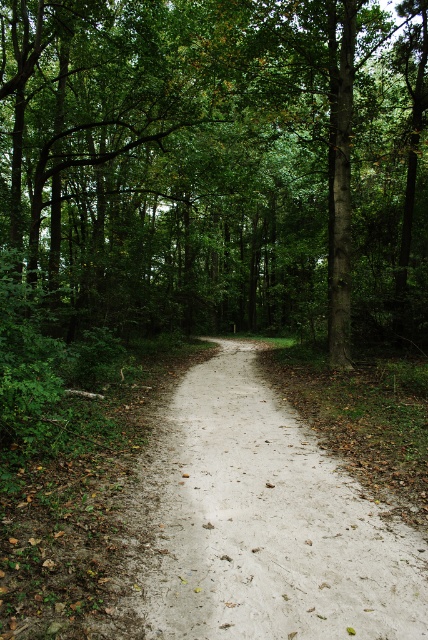
Does green leafy tree at center appear under sandy path at center?

Actually, green leafy tree at center is above sandy path at center.

Between green leafy tree at center and sandy path at center, which one is positioned lower?

Positioned lower is sandy path at center.

Image resolution: width=428 pixels, height=640 pixels. Describe the element at coordinates (216, 164) in the screenshot. I see `green leafy tree at center` at that location.

Where is `green leafy tree at center`? This screenshot has height=640, width=428. green leafy tree at center is located at coordinates (216, 164).